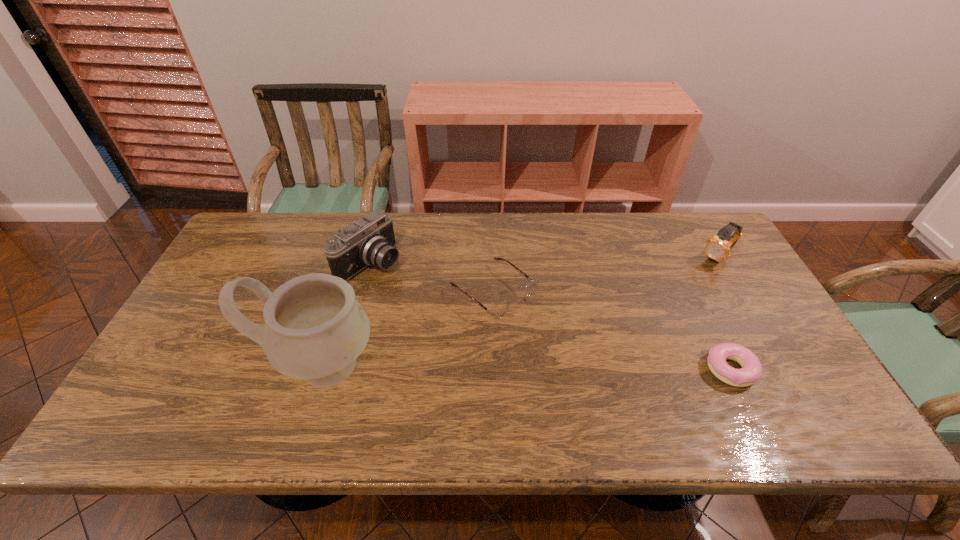
Locate an element on the screen. This screenshot has height=540, width=960. vacant area located on the face of the watch is located at coordinates (689, 281).

This screenshot has width=960, height=540. I want to click on free location located on the face of the watch, so click(627, 333).

Where is `blank space located on the face of the watch`? This screenshot has height=540, width=960. blank space located on the face of the watch is located at coordinates (638, 323).

At what (x,y) coordinates should I click in order to perform the action: click on vacant space situated 0.290m on the front-facing side of the fourth tallest object. Please return your answer as a coordinate pair (x, y). Looking at the image, I should click on (607, 387).

Locate an element on the screen. free point located on the front-facing side of the fourth tallest object is located at coordinates (577, 362).

Where is `blank space located 0.320m on the front-facing side of the fourth tallest object`? The image size is (960, 540). blank space located 0.320m on the front-facing side of the fourth tallest object is located at coordinates (616, 395).

The image size is (960, 540). In order to click on free location located 0.400m on the front-facing side of the camera in this screenshot , I will do coord(503,340).

The height and width of the screenshot is (540, 960). Find the location of `vacant space located 0.220m on the front-facing side of the camera`. vacant space located 0.220m on the front-facing side of the camera is located at coordinates (450, 308).

At what (x,y) coordinates should I click in order to perform the action: click on free space located 0.100m on the front-facing side of the camera. Please return your answer as a coordinate pair (x, y). The image size is (960, 540). Looking at the image, I should click on (418, 290).

This screenshot has height=540, width=960. Identify the location of watch located in the far edge section of the desktop. (718, 247).